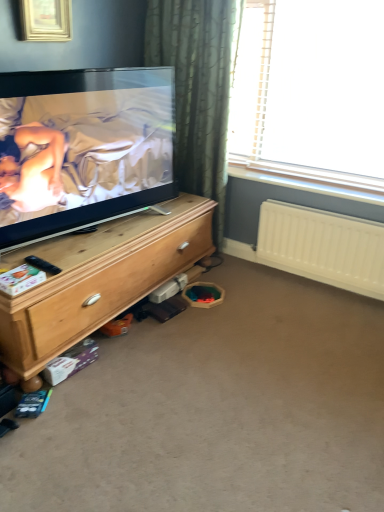
Where is `free space behind black plastic remote control at lower left`? free space behind black plastic remote control at lower left is located at coordinates (56, 252).